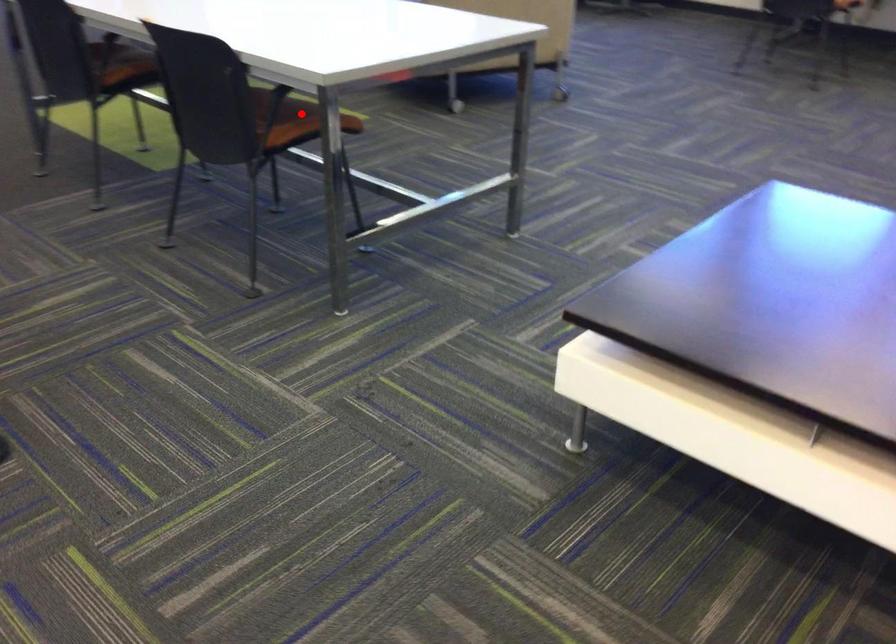
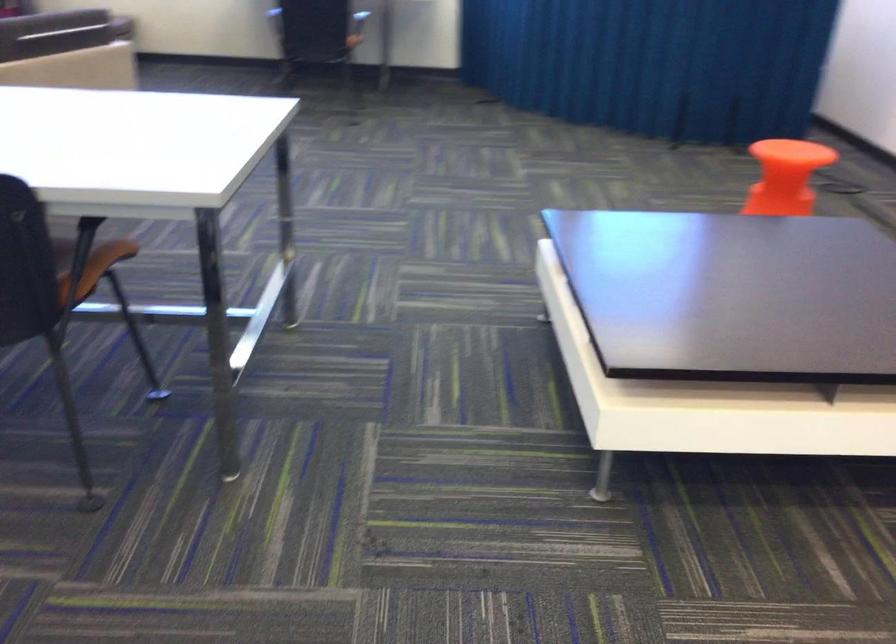
Locate, in the second image, the point that corresponds to the highlighted location in the first image.

(62, 252)